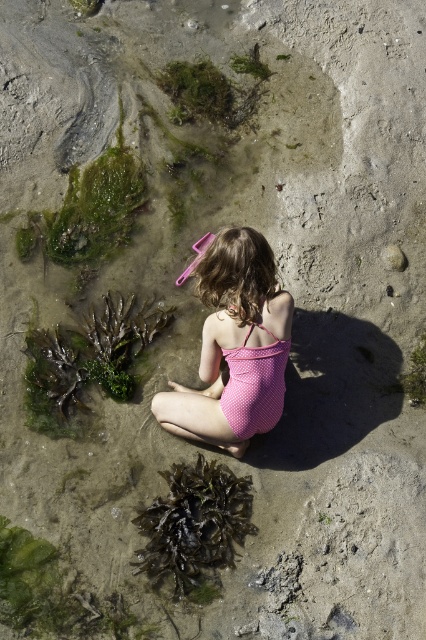
Question: Considering the real-world distances, which object is closest to the pink polka dot swimsuit at center?

Choices:
 (A) dark green seaweed at lower left
 (B) green mossy algae at lower left

Answer: (A)

Question: Is pink polka dot swimsuit at center to the right of green mossy algae at lower left from the viewer's perspective?

Choices:
 (A) no
 (B) yes

Answer: (B)

Question: Which point is closer to the camera?

Choices:
 (A) (189, 577)
 (B) (46, 404)

Answer: (A)

Question: Which of the following is the farthest from the observer?

Choices:
 (A) (232, 248)
 (B) (160, 545)
 (C) (108, 396)

Answer: (C)

Question: Is the position of pink polka dot swimsuit at center less distant than that of dark green seaweed at lower left?

Choices:
 (A) yes
 (B) no

Answer: (A)

Question: In this image, where is green mossy algae at lower left located relative to dark green seaweed at lower left?

Choices:
 (A) left
 (B) right

Answer: (A)